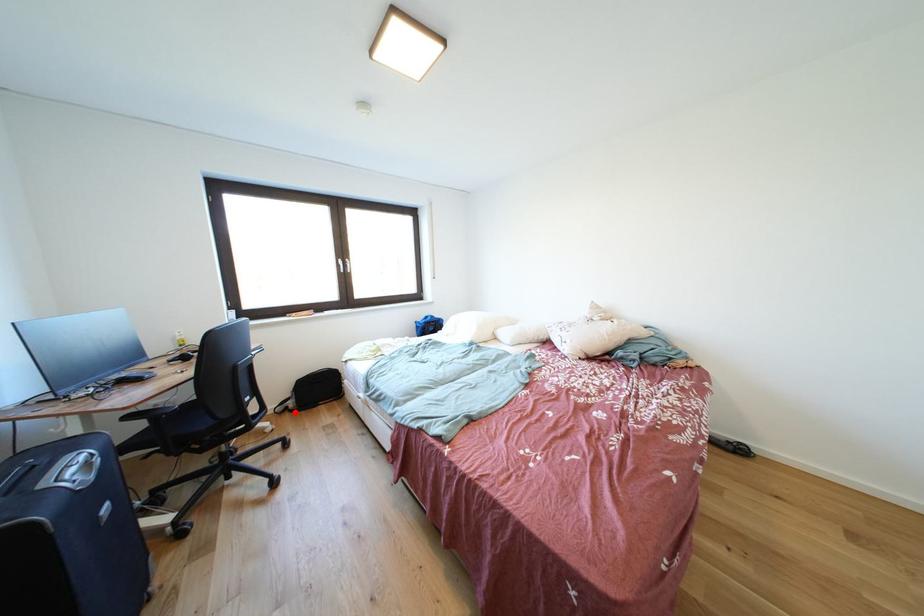
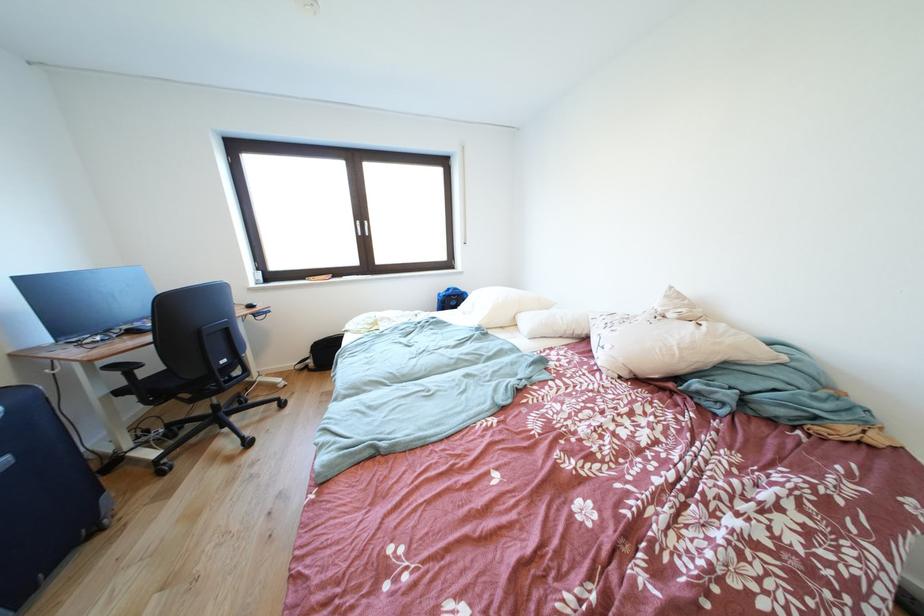
Question: I am providing you with two images of the same scene from different viewpoints. In image1, a red point is highlighted. Considering the same 3D point in image2, which of the following is correct?

Choices:
 (A) It is closer
 (B) It is farther

Answer: (B)